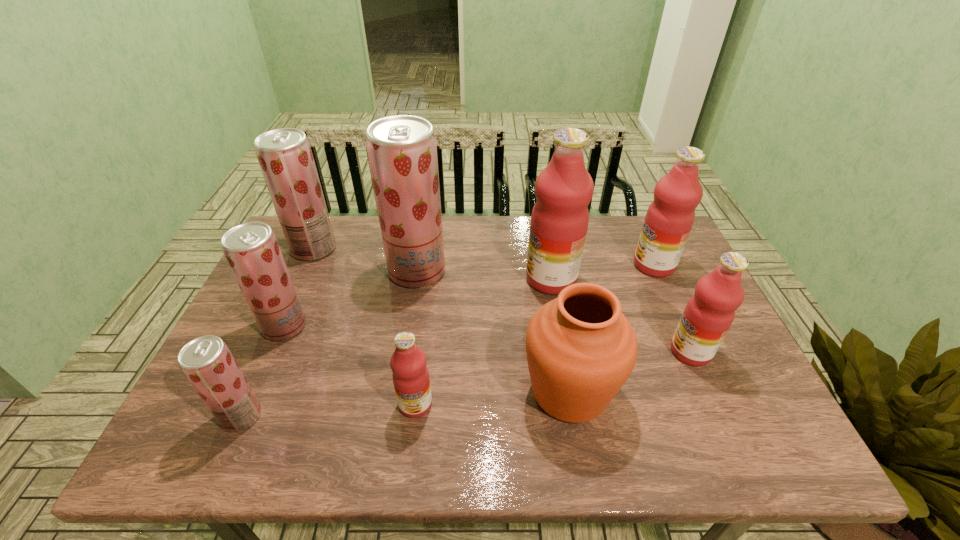
Identify the location of blank region between the second biggest strawberry fruit juice and the brown urn. (442, 320).

Image resolution: width=960 pixels, height=540 pixels. I want to click on vacant region between the leftmost pink fruit juice and the second pink fruit juice from left to right, so click(x=484, y=341).

I want to click on free space between the second nearest strawberry fruit juice and the second nearest pink fruit juice, so click(488, 339).

You are a GUI agent. You are given a task and a screenshot of the screen. Output one action in this format:
    pyautogui.click(x=<x>, y=<y>)
    Task: Click on the vacant area that lies between the smallest pink fruit juice and the second nearest strawberry fruit juice
    
    Given the screenshot: What is the action you would take?
    pyautogui.click(x=350, y=365)

Select which object appears as the fifth closest to the third fruit juice from right to left. Please provide its 2D coordinates. Your answer should be formatted as a tuple, i.e. [(x, y)], where the tuple contains the x and y coordinates of a point satisfying the conditions above.

[(410, 375)]

Point out which object is positioned as the fifth nearest to the biggest pink fruit juice. Please provide its 2D coordinates. Your answer should be formatted as a tuple, i.e. [(x, y)], where the tuple contains the x and y coordinates of a point satisfying the conditions above.

[(410, 375)]

This screenshot has height=540, width=960. In order to click on fruit juice that is the nearest to the third smallest pink fruit juice in this screenshot , I will do `click(564, 188)`.

Choose which fruit juice is the fifth nearest neighbor to the smallest strawberry fruit juice. Please provide its 2D coordinates. Your answer should be formatted as a tuple, i.e. [(x, y)], where the tuple contains the x and y coordinates of a point satisfying the conditions above.

[(564, 188)]

In order to click on strawberry fruit juice that stands as the closest to the third smallest pink fruit juice in this screenshot , I will do `click(402, 152)`.

Where is `strawberry fruit juice that can be found as the second closest to the smallest strawberry fruit juice`? strawberry fruit juice that can be found as the second closest to the smallest strawberry fruit juice is located at coordinates (402, 152).